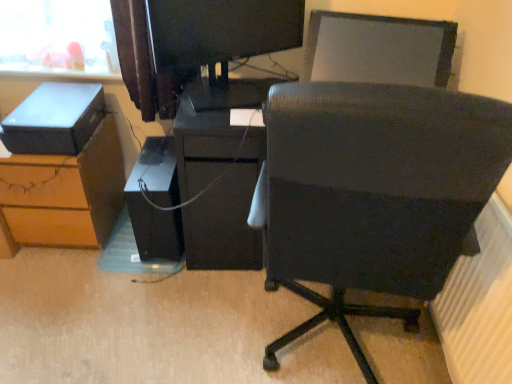
The image size is (512, 384). Find the location of `vacant space in front of black matte computer tower at center`. vacant space in front of black matte computer tower at center is located at coordinates (x=146, y=286).